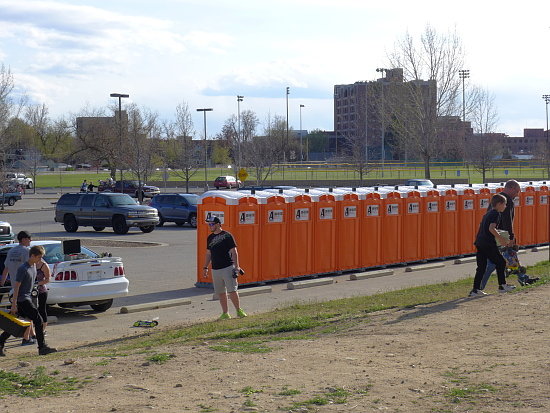
Image resolution: width=550 pixels, height=413 pixels. In order to click on lights in this screenshot , I will do `click(120, 92)`, `click(206, 110)`, `click(242, 97)`, `click(282, 93)`, `click(305, 107)`, `click(467, 77)`, `click(544, 99)`.